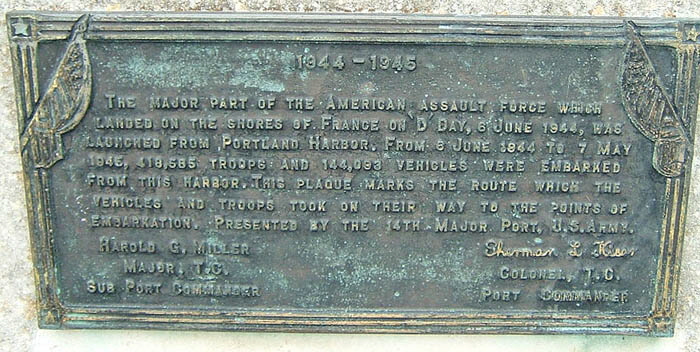
Locate an element on the screen. The height and width of the screenshot is (352, 700). top side of frame around plaque is located at coordinates (332, 24).